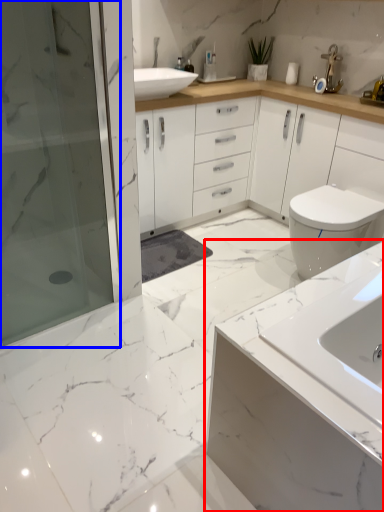
Question: Among these objects, which one is farthest to the camera, bathroom cabinet (highlighted by a red box) or shower door (highlighted by a blue box)?

Choices:
 (A) bathroom cabinet
 (B) shower door

Answer: (B)